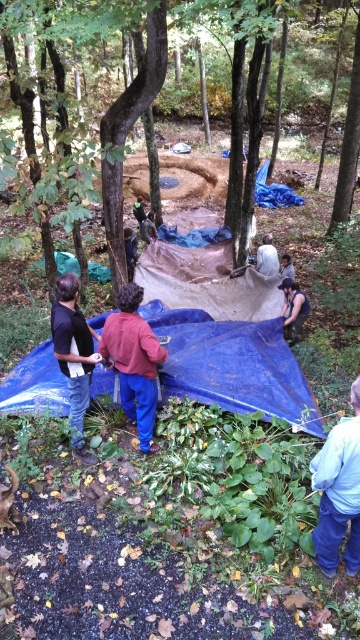
You are standing at the edge of the excavation pit in the forest scene. You notice a point marked at coordinates (x=348, y=150). What object is located at that point?

The point at coordinates (x=348, y=150) indicates the location of the brown rough tarp at center.

Looking at this image, you are a hiker who has stumbled upon this excavation site. You need to cross over to the other side of the pit. The smooth bark tree at center is blocking your path. Can you step over the brown rough tarp at center to bypass the tree?

The brown rough tarp at center is located above the smooth bark tree at center, so stepping over the brown rough tarp at center would allow you to bypass the tree since it is positioned over the obstruction.